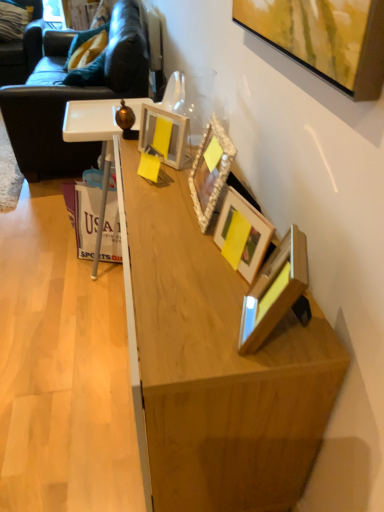
Identify the location of vacant space situated on the left part of wooden desk at center. (63, 354).